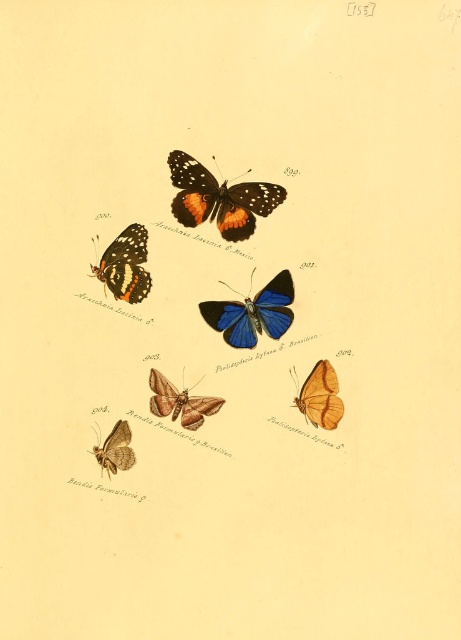
Question: Estimate the real-world distances between objects in this image. Which object is farther from the orange and black butterfly at center?

Choices:
 (A) blue glossy butterfly at center
 (B) brown matte moth at center

Answer: (B)

Question: Observing the image, what is the correct spatial positioning of orange and black butterfly at center in reference to blue glossy butterfly at center?

Choices:
 (A) below
 (B) above

Answer: (B)

Question: Can you confirm if orange matte butterfly at center is positioned above matte brown moth at lower left?

Choices:
 (A) yes
 (B) no

Answer: (A)

Question: Which object is farther from the camera taking this photo?

Choices:
 (A) blue glossy butterfly at center
 (B) brown matte moth at center
 (C) orange matte butterfly at center

Answer: (A)

Question: In this image, where is orange matte butterfly at center located relative to matte brown moth at lower left?

Choices:
 (A) right
 (B) left

Answer: (A)

Question: Among these points, which one is farthest from the camera?

Choices:
 (A) (191, 225)
 (B) (336, 413)

Answer: (A)